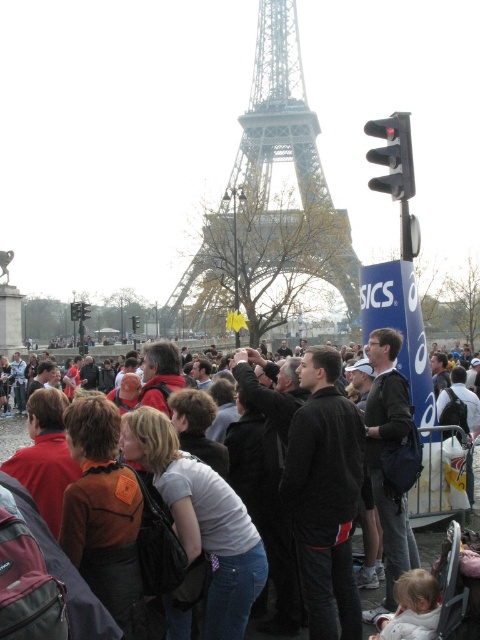
Question: Does metallic silver eiffel tower at center appear on the right side of dark gray jacket at center?

Choices:
 (A) no
 (B) yes

Answer: (B)

Question: Which point is farther to the camera?

Choices:
 (A) metallic silver eiffel tower at center
 (B) dark gray jacket at center

Answer: (A)

Question: Is metallic silver eiffel tower at center positioned before dark gray jacket at center?

Choices:
 (A) no
 (B) yes

Answer: (A)

Question: Does metallic silver eiffel tower at center have a smaller size compared to dark gray jacket at center?

Choices:
 (A) no
 (B) yes

Answer: (A)